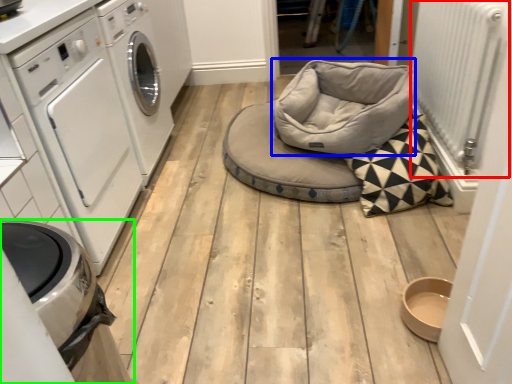
Question: Which object is the closest to the radiator (highlighted by a red box)? Choose among these: bean bag chair (highlighted by a blue box) or home appliance (highlighted by a green box).

Choices:
 (A) bean bag chair
 (B) home appliance

Answer: (A)